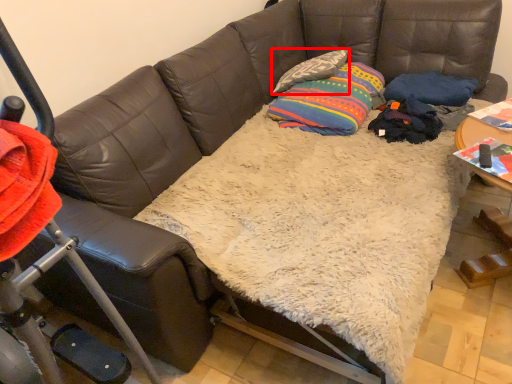
Question: Observing the image, what is the correct spatial positioning of pillow (annotated by the red box) in reference to throw pillow?

Choices:
 (A) left
 (B) right

Answer: (A)